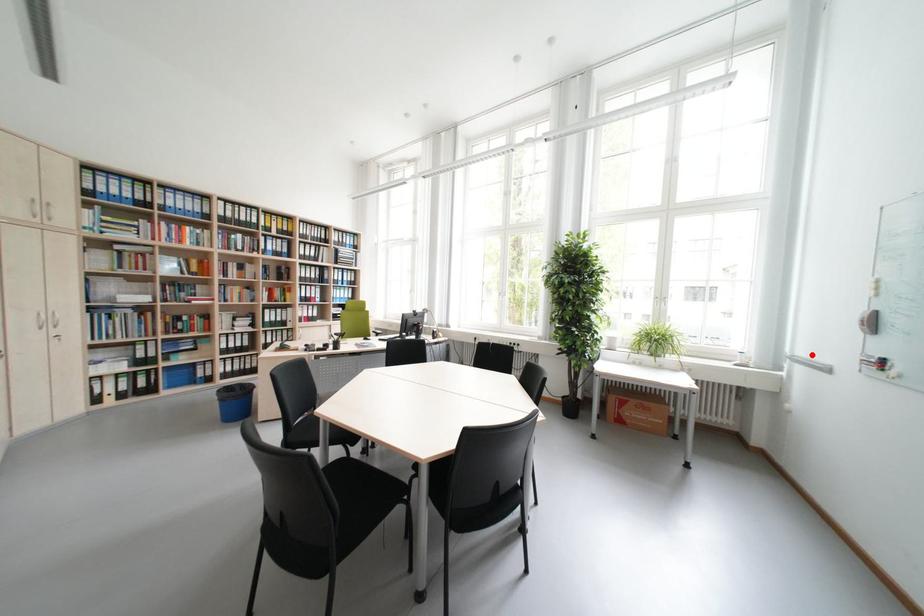
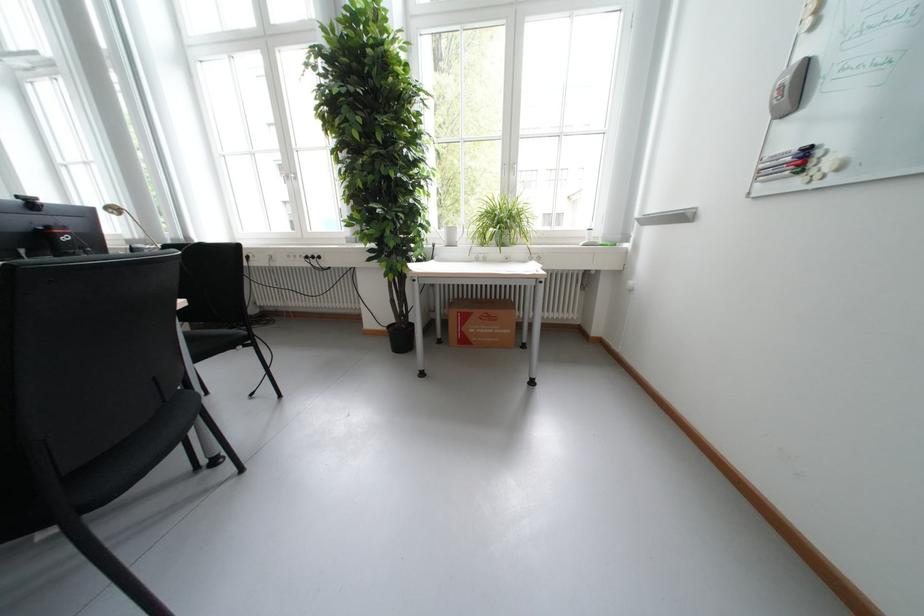
Find the pixel in the second image that matches the highlighted location in the first image.

(664, 211)